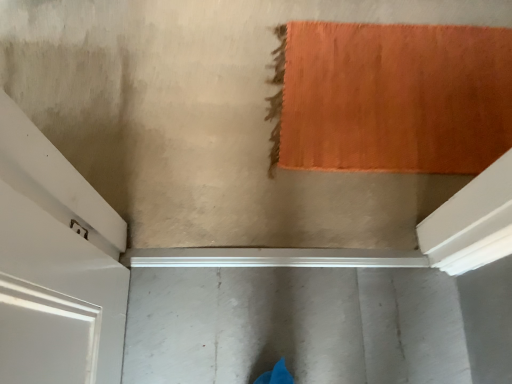
The width and height of the screenshot is (512, 384). What do you see at coordinates (294, 325) in the screenshot?
I see `gray concrete at center` at bounding box center [294, 325].

At what (x,y) coordinates should I click in order to perform the action: click on gray concrete at center. Please return your answer as a coordinate pair (x, y). Looking at the image, I should click on (294, 325).

Find the location of `gray concrete at center`. gray concrete at center is located at coordinates tap(294, 325).